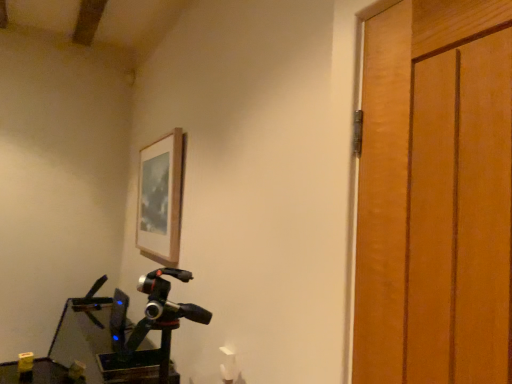
Question: Is metallic green workbench at lower left facing towards wooden picture frame at upper center?

Choices:
 (A) yes
 (B) no

Answer: (B)

Question: Considering the relative sizes of metallic green workbench at lower left and wooden picture frame at upper center in the image provided, is metallic green workbench at lower left bigger than wooden picture frame at upper center?

Choices:
 (A) no
 (B) yes

Answer: (B)

Question: From the image's perspective, does metallic green workbench at lower left appear higher than wooden picture frame at upper center?

Choices:
 (A) yes
 (B) no

Answer: (B)

Question: Can you confirm if metallic green workbench at lower left is smaller than wooden picture frame at upper center?

Choices:
 (A) no
 (B) yes

Answer: (A)

Question: Can you confirm if metallic green workbench at lower left is shorter than wooden picture frame at upper center?

Choices:
 (A) no
 (B) yes

Answer: (A)

Question: Does metallic green workbench at lower left appear on the right side of wooden picture frame at upper center?

Choices:
 (A) yes
 (B) no

Answer: (B)

Question: Does wooden picture frame at upper center have a smaller size compared to metallic green workbench at lower left?

Choices:
 (A) yes
 (B) no

Answer: (A)

Question: Is wooden picture frame at upper center closer to the viewer compared to metallic green workbench at lower left?

Choices:
 (A) no
 (B) yes

Answer: (A)

Question: Does wooden picture frame at upper center have a greater width compared to metallic green workbench at lower left?

Choices:
 (A) yes
 (B) no

Answer: (B)

Question: From the image's perspective, would you say wooden picture frame at upper center is shown under metallic green workbench at lower left?

Choices:
 (A) yes
 (B) no

Answer: (B)

Question: Is wooden picture frame at upper center bigger than metallic green workbench at lower left?

Choices:
 (A) yes
 (B) no

Answer: (B)

Question: Can we say wooden picture frame at upper center lies outside metallic green workbench at lower left?

Choices:
 (A) no
 (B) yes

Answer: (B)

Question: Considering the positions of wooden picture frame at upper center and metallic green workbench at lower left in the image, is wooden picture frame at upper center bigger or smaller than metallic green workbench at lower left?

Choices:
 (A) big
 (B) small

Answer: (B)